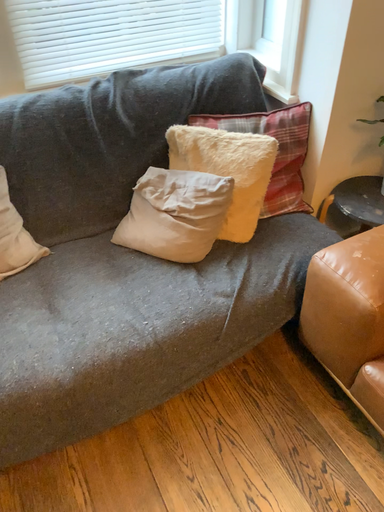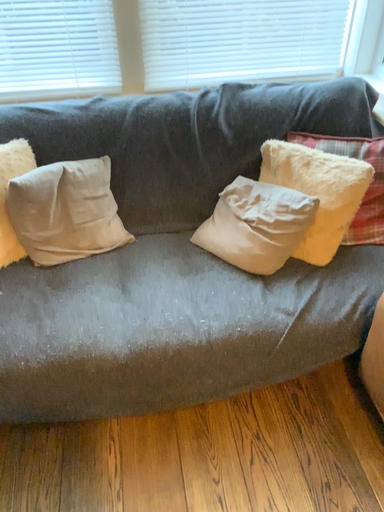
Question: Which way did the camera rotate in the video?

Choices:
 (A) rotated left
 (B) rotated right

Answer: (A)